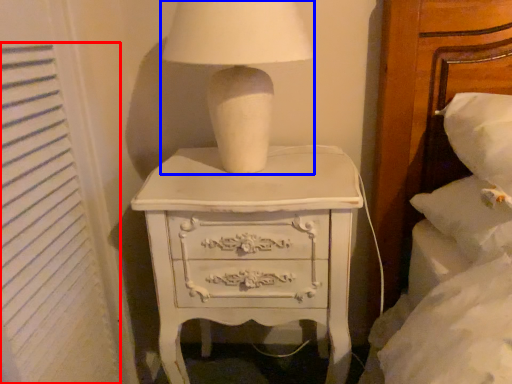
Question: Among these objects, which one is farthest to the camera, curtain (highlighted by a red box) or table lamp (highlighted by a blue box)?

Choices:
 (A) curtain
 (B) table lamp

Answer: (B)